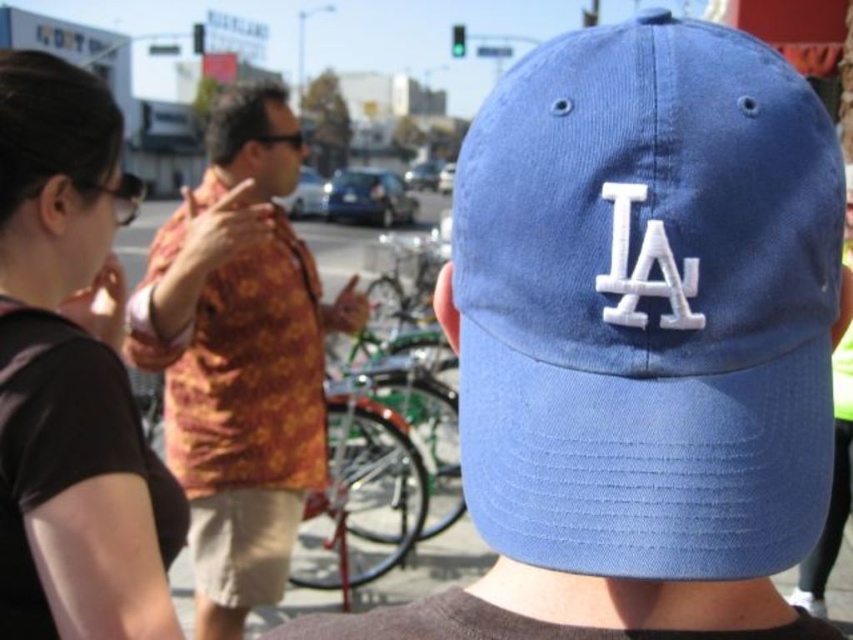
In the scene shown: Can you confirm if floral-patterned shirt at center is bigger than matte blue cap at center?

Yes, floral-patterned shirt at center is bigger than matte blue cap at center.

Locate an element on the screen. Image resolution: width=853 pixels, height=640 pixels. floral-patterned shirt at center is located at coordinates (241, 356).

Where is `floral-patterned shirt at center`? The width and height of the screenshot is (853, 640). floral-patterned shirt at center is located at coordinates (241, 356).

Find the location of a particular element. The width and height of the screenshot is (853, 640). floral-patterned shirt at center is located at coordinates (241, 356).

Which is more to the right, black fabric shirt at upper left or matte blue cap at center?

From the viewer's perspective, matte blue cap at center appears more on the right side.

The height and width of the screenshot is (640, 853). Find the location of `black fabric shirt at upper left`. black fabric shirt at upper left is located at coordinates (71, 376).

Image resolution: width=853 pixels, height=640 pixels. I want to click on black fabric shirt at upper left, so click(x=71, y=376).

Can you confirm if black fabric shirt at upper left is thinner than floral-patterned shirt at center?

Indeed, black fabric shirt at upper left has a lesser width compared to floral-patterned shirt at center.

Can you confirm if black fabric shirt at upper left is positioned to the left of floral-patterned shirt at center?

In fact, black fabric shirt at upper left is to the right of floral-patterned shirt at center.

Who is more distant from viewer, (157, 609) or (247, 394)?

The point (247, 394) is more distant.

The width and height of the screenshot is (853, 640). I want to click on black fabric shirt at upper left, so click(71, 376).